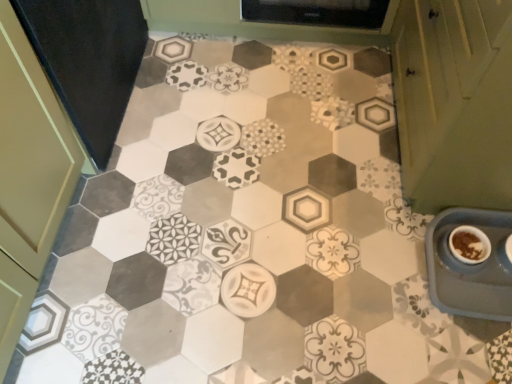
Question: Considering the relative positions of blue plastic tray at lower right and brown matte bowl at lower right in the image provided, is blue plastic tray at lower right to the right of brown matte bowl at lower right from the viewer's perspective?

Choices:
 (A) yes
 (B) no

Answer: (A)

Question: From the image's perspective, is blue plastic tray at lower right on brown matte bowl at lower right?

Choices:
 (A) yes
 (B) no

Answer: (B)

Question: Is the depth of blue plastic tray at lower right greater than that of brown matte bowl at lower right?

Choices:
 (A) yes
 (B) no

Answer: (B)

Question: From a real-world perspective, is blue plastic tray at lower right beneath brown matte bowl at lower right?

Choices:
 (A) no
 (B) yes

Answer: (B)

Question: Does blue plastic tray at lower right have a larger size compared to brown matte bowl at lower right?

Choices:
 (A) yes
 (B) no

Answer: (A)

Question: Could brown matte bowl at lower right be considered to be inside blue plastic tray at lower right?

Choices:
 (A) yes
 (B) no

Answer: (A)

Question: Is brown matte bowl at lower right to the right of green matte cabinet at right from the viewer's perspective?

Choices:
 (A) no
 (B) yes

Answer: (A)

Question: Does brown matte bowl at lower right have a lesser width compared to green matte cabinet at right?

Choices:
 (A) yes
 (B) no

Answer: (A)

Question: From the image's perspective, would you say brown matte bowl at lower right is positioned over green matte cabinet at right?

Choices:
 (A) no
 (B) yes

Answer: (A)

Question: Does brown matte bowl at lower right have a larger size compared to green matte cabinet at right?

Choices:
 (A) no
 (B) yes

Answer: (A)

Question: Is brown matte bowl at lower right facing away from green matte cabinet at right?

Choices:
 (A) no
 (B) yes

Answer: (B)

Question: From a real-world perspective, is brown matte bowl at lower right below green matte cabinet at right?

Choices:
 (A) no
 (B) yes

Answer: (B)

Question: Can you confirm if green matte cabinet at right is wider than blue plastic tray at lower right?

Choices:
 (A) no
 (B) yes

Answer: (B)